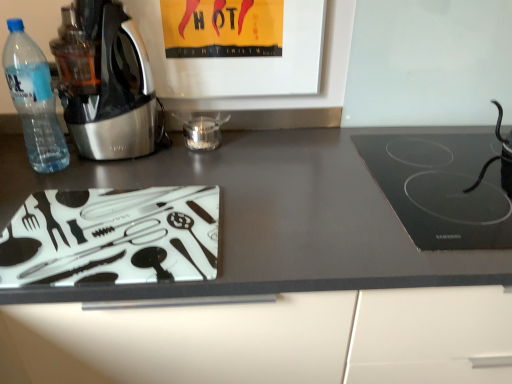
This screenshot has width=512, height=384. I want to click on free spot in front of metallic stainless steel kettle at left, so click(95, 172).